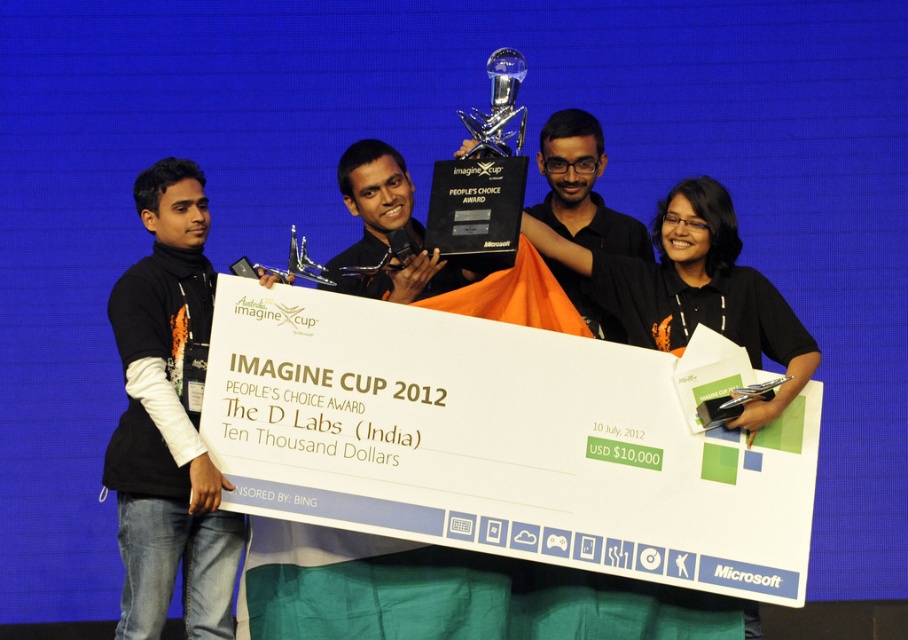
Question: Does black turtleneck sweater at left have a smaller size compared to black matte shirt at center?

Choices:
 (A) no
 (B) yes

Answer: (B)

Question: Does black matte shirt at center have a greater width compared to clear glass trophy at center?

Choices:
 (A) no
 (B) yes

Answer: (B)

Question: Which object appears closest to the camera in this image?

Choices:
 (A) clear glass trophy at center
 (B) black turtleneck sweater at left
 (C) black matte shirt at center

Answer: (A)

Question: Does black matte shirt at center appear under clear glass trophy at center?

Choices:
 (A) no
 (B) yes

Answer: (B)

Question: Which of the following is the farthest from the observer?

Choices:
 (A) black turtleneck sweater at left
 (B) black matte shirt at center
 (C) clear glass trophy at center

Answer: (B)

Question: Which point appears closest to the camera in this image?

Choices:
 (A) (119, 634)
 (B) (474, 134)
 (C) (585, 112)

Answer: (A)